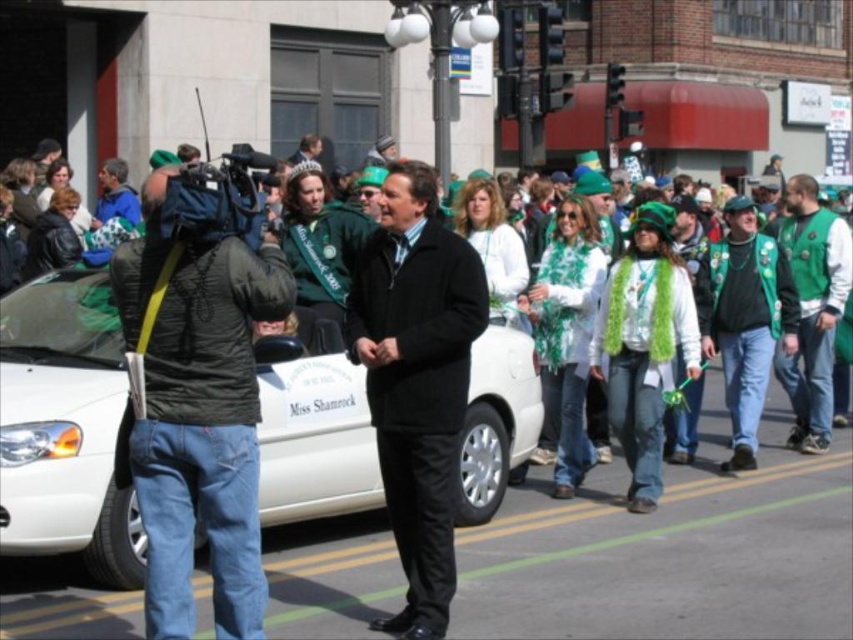
You are a photographer at the St. Patrick Day parade. You see a white glossy car at center and a green textured vest at right. Which object is nearer to you?

The white glossy car at center is closer to the viewer than the green textured vest at right.

Based on the photo, you are a photographer at the St. Patrick Day parade. You want to focus your camera on the point that is closer to you. Which point should you choose between point (x=291, y=476) and point (x=790, y=259)?

Point (x=291, y=476) is closer to the camera than point (x=790, y=259), so you should focus on point (x=291, y=476).